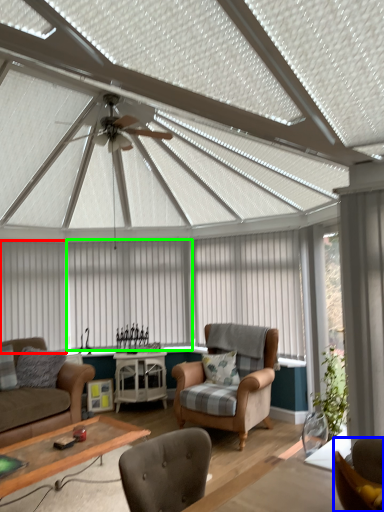
Question: Based on their relative distances, which object is nearer to curtain (highlighted by a red box)? Choose from chair (highlighted by a blue box) and curtain (highlighted by a green box).

Choices:
 (A) chair
 (B) curtain

Answer: (B)